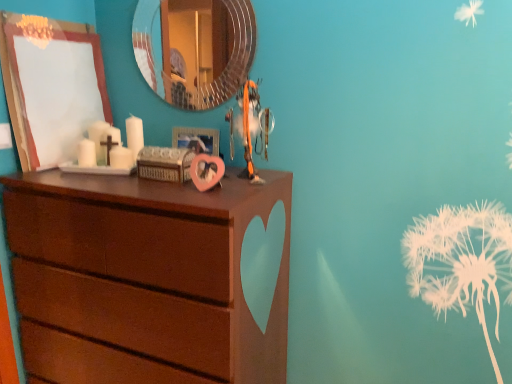
Locate an element on the screen. The width and height of the screenshot is (512, 384). wooden picture frame at upper left, the second picture frame in the right-to-left sequence is located at coordinates (53, 90).

Describe the element at coordinates (252, 127) in the screenshot. The height and width of the screenshot is (384, 512). I see `orange fabric toy at center` at that location.

Where is `wooden picture frame at upper left, the second picture frame in the right-to-left sequence`? wooden picture frame at upper left, the second picture frame in the right-to-left sequence is located at coordinates [x=53, y=90].

Is the depth of orange fabric toy at center greater than that of brown wood chest of drawers at left?

Yes, orange fabric toy at center is behind brown wood chest of drawers at left.

Which of these two, orange fabric toy at center or brown wood chest of drawers at left, stands shorter?

orange fabric toy at center is shorter.

Is orange fabric toy at center turned away from brown wood chest of drawers at left?

orange fabric toy at center is not turned away from brown wood chest of drawers at left.

Is orange fabric toy at center placed right next to brown wood chest of drawers at left?

orange fabric toy at center is not next to brown wood chest of drawers at left, and they're not touching.

Are pink matte heart-shaped frame at center, arranged as the 2th picture frame when viewed from the left, and brown wood chest of drawers at left far apart?

No, pink matte heart-shaped frame at center, arranged as the 2th picture frame when viewed from the left, is not far away from brown wood chest of drawers at left.

Locate an element on the screen. This screenshot has width=512, height=384. the chest of drawers below the pink matte heart-shaped frame at center, marked as the first picture frame in a right-to-left arrangement (from the image's perspective) is located at coordinates (152, 267).

From a real-world perspective, is pink matte heart-shaped frame at center, marked as the first picture frame in a right-to-left arrangement, positioned over brown wood chest of drawers at left based on gravity?

Yes, from a real-world perspective, pink matte heart-shaped frame at center, marked as the first picture frame in a right-to-left arrangement, is on top of brown wood chest of drawers at left.

Is pink matte heart-shaped frame at center, marked as the first picture frame in a right-to-left arrangement, spatially inside brown wood chest of drawers at left, or outside of it?

pink matte heart-shaped frame at center, marked as the first picture frame in a right-to-left arrangement, is not inside brown wood chest of drawers at left, it's outside.

Which is in front, point (190, 141) or point (184, 89)?

The point (190, 141) is closer to the camera.

Based on the photo, who is smaller, pink matte heart-shaped frame at center, arranged as the 2th picture frame when viewed from the left, or metallic circular mirror at upper center?

pink matte heart-shaped frame at center, arranged as the 2th picture frame when viewed from the left.

Consider the image. From their relative heights in the image, would you say pink matte heart-shaped frame at center, marked as the first picture frame in a right-to-left arrangement, is taller or shorter than metallic circular mirror at upper center?

In the image, pink matte heart-shaped frame at center, marked as the first picture frame in a right-to-left arrangement, appears to be shorter than metallic circular mirror at upper center.

Can you tell me how much pink matte heart-shaped frame at center, arranged as the 2th picture frame when viewed from the left, and metallic circular mirror at upper center differ in facing direction?

2.44 degrees separate the facing orientations of pink matte heart-shaped frame at center, arranged as the 2th picture frame when viewed from the left, and metallic circular mirror at upper center.

Considering the sizes of objects wooden picture frame at upper left, the second picture frame in the right-to-left sequence, and orange fabric toy at center in the image provided, who is thinner, wooden picture frame at upper left, the second picture frame in the right-to-left sequence, or orange fabric toy at center?

Thinner between the two is wooden picture frame at upper left, the second picture frame in the right-to-left sequence.

Does wooden picture frame at upper left, the second picture frame in the right-to-left sequence, turn towards orange fabric toy at center?

Yes, wooden picture frame at upper left, the second picture frame in the right-to-left sequence, faces towards orange fabric toy at center.

Is wooden picture frame at upper left, the second picture frame in the right-to-left sequence, positioned in front of orange fabric toy at center?

That is False.

Is the surface of wooden picture frame at upper left, the second picture frame in the right-to-left sequence, in direct contact with pink matte heart-shaped frame at center, arranged as the 2th picture frame when viewed from the left?

No, wooden picture frame at upper left, the second picture frame in the right-to-left sequence, is not in contact with pink matte heart-shaped frame at center, arranged as the 2th picture frame when viewed from the left.

Is point (69, 99) closer or farther from the camera than point (210, 148)?

Point (69, 99) is positioned farther from the camera compared to point (210, 148).

Is wooden picture frame at upper left, which is the first picture frame from left to right, to the right of pink matte heart-shaped frame at center, arranged as the 2th picture frame when viewed from the left, from the viewer's perspective?

No, wooden picture frame at upper left, which is the first picture frame from left to right, is not to the right of pink matte heart-shaped frame at center, arranged as the 2th picture frame when viewed from the left.

Could you tell me if wooden picture frame at upper left, which is the first picture frame from left to right, is facing pink matte heart-shaped frame at center, arranged as the 2th picture frame when viewed from the left?

Yes, wooden picture frame at upper left, which is the first picture frame from left to right, faces towards pink matte heart-shaped frame at center, arranged as the 2th picture frame when viewed from the left.

Is brown wood chest of drawers at left looking in the opposite direction of orange fabric toy at center?

No, brown wood chest of drawers at left is not facing away from orange fabric toy at center.

Which object is thinner, brown wood chest of drawers at left or orange fabric toy at center?

orange fabric toy at center.

From a real-world perspective, who is located higher, brown wood chest of drawers at left or orange fabric toy at center?

orange fabric toy at center, from a real-world perspective.

From the image's perspective, which is above, brown wood chest of drawers at left or orange fabric toy at center?

orange fabric toy at center appears higher in the image.

Consider the image. Considering the positions of objects wooden picture frame at upper left, which is the first picture frame from left to right, and brown wood chest of drawers at left in the image provided, who is more to the left, wooden picture frame at upper left, which is the first picture frame from left to right, or brown wood chest of drawers at left?

wooden picture frame at upper left, which is the first picture frame from left to right.

Find the location of a particular element. the chest of drawers that is in front of the wooden picture frame at upper left, which is the first picture frame from left to right is located at coordinates (152, 267).

Can brown wood chest of drawers at left be found inside wooden picture frame at upper left, which is the first picture frame from left to right?

No, brown wood chest of drawers at left is located outside of wooden picture frame at upper left, which is the first picture frame from left to right.

Can you confirm if wooden picture frame at upper left, the second picture frame in the right-to-left sequence, is thinner than brown wood chest of drawers at left?

Correct, the width of wooden picture frame at upper left, the second picture frame in the right-to-left sequence, is less than that of brown wood chest of drawers at left.

Where is `the chest of drawers in front of the orange fabric toy at center`? the chest of drawers in front of the orange fabric toy at center is located at coordinates (152, 267).

Where is `picture frame that is the 2nd one when counting backward from the brown wood chest of drawers at left`? picture frame that is the 2nd one when counting backward from the brown wood chest of drawers at left is located at coordinates (195, 138).

Based on the photo, estimate the real-world distances between objects in this image. Which object is further from orange fabric toy at center, pink matte heart-shaped frame at center, marked as the first picture frame in a right-to-left arrangement, or brown wood chest of drawers at left?

brown wood chest of drawers at left is positioned further to the anchor orange fabric toy at center.

Considering their positions, is metallic circular mirror at upper center positioned closer to pink matte heart-shaped frame at center, arranged as the 2th picture frame when viewed from the left, than brown wood chest of drawers at left?

brown wood chest of drawers at left lies closer to pink matte heart-shaped frame at center, arranged as the 2th picture frame when viewed from the left, than the other object.

Based on their spatial positions, is pink matte heart-shaped frame at center, arranged as the 2th picture frame when viewed from the left, or wooden picture frame at upper left, the second picture frame in the right-to-left sequence, closer to metallic circular mirror at upper center?

wooden picture frame at upper left, the second picture frame in the right-to-left sequence, is positioned closer to the anchor metallic circular mirror at upper center.

Based on their spatial positions, is orange fabric toy at center or metallic circular mirror at upper center closer to wooden picture frame at upper left, which is the first picture frame from left to right?

The object closer to wooden picture frame at upper left, which is the first picture frame from left to right, is orange fabric toy at center.

Looking at the image, which one is located closer to metallic circular mirror at upper center, pink matte heart-shaped frame at center, marked as the first picture frame in a right-to-left arrangement, or brown wood chest of drawers at left?

pink matte heart-shaped frame at center, marked as the first picture frame in a right-to-left arrangement, is closer to metallic circular mirror at upper center.

From the image, which object appears to be farther from orange fabric toy at center, wooden picture frame at upper left, which is the first picture frame from left to right, or brown wood chest of drawers at left?

wooden picture frame at upper left, which is the first picture frame from left to right, is positioned further to the anchor orange fabric toy at center.

When comparing their distances from metallic circular mirror at upper center, does brown wood chest of drawers at left or orange fabric toy at center seem further?

Based on the image, brown wood chest of drawers at left appears to be further to metallic circular mirror at upper center.

Based on their spatial positions, is orange fabric toy at center or wooden picture frame at upper left, the second picture frame in the right-to-left sequence, closer to metallic circular mirror at upper center?

wooden picture frame at upper left, the second picture frame in the right-to-left sequence, is closer to metallic circular mirror at upper center.

You are a GUI agent. You are given a task and a screenshot of the screen. Output one action in this format:
    pyautogui.click(x=<x>, y=<y>)
    Task: Click on the mirror between wooden picture frame at upper left, the second picture frame in the right-to-left sequence, and orange fabric toy at center, in the horizontal direction
    The height and width of the screenshot is (384, 512).
    Given the screenshot: What is the action you would take?
    pyautogui.click(x=194, y=49)

You are a GUI agent. You are given a task and a screenshot of the screen. Output one action in this format:
    pyautogui.click(x=<x>, y=<y>)
    Task: Click on the picture frame that lies between wooden picture frame at upper left, which is the first picture frame from left to right, and brown wood chest of drawers at left from top to bottom
    The width and height of the screenshot is (512, 384).
    Given the screenshot: What is the action you would take?
    pyautogui.click(x=195, y=138)

In order to click on picture frame situated between wooden picture frame at upper left, the second picture frame in the right-to-left sequence, and orange fabric toy at center from left to right in this screenshot , I will do `click(195, 138)`.

Find the location of `toy between wooden picture frame at upper left, which is the first picture frame from left to right, and brown wood chest of drawers at left, in the vertical direction`. toy between wooden picture frame at upper left, which is the first picture frame from left to right, and brown wood chest of drawers at left, in the vertical direction is located at coordinates (252, 127).